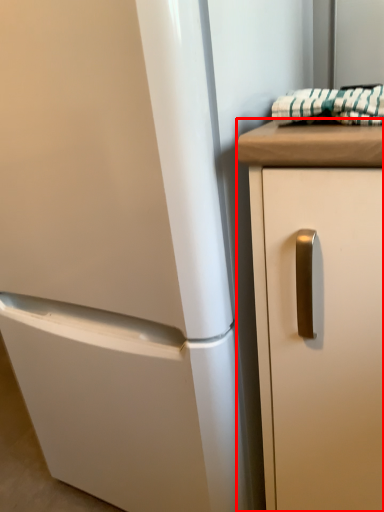
Question: From the image, what is the correct spatial relationship of cabinetry (annotated by the red box) in relation to blanket?

Choices:
 (A) left
 (B) right

Answer: (B)